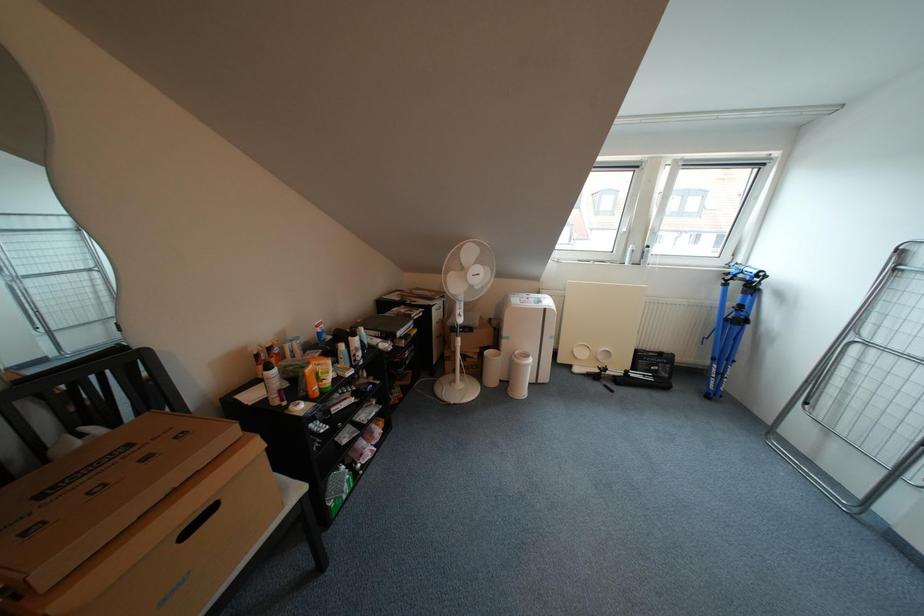
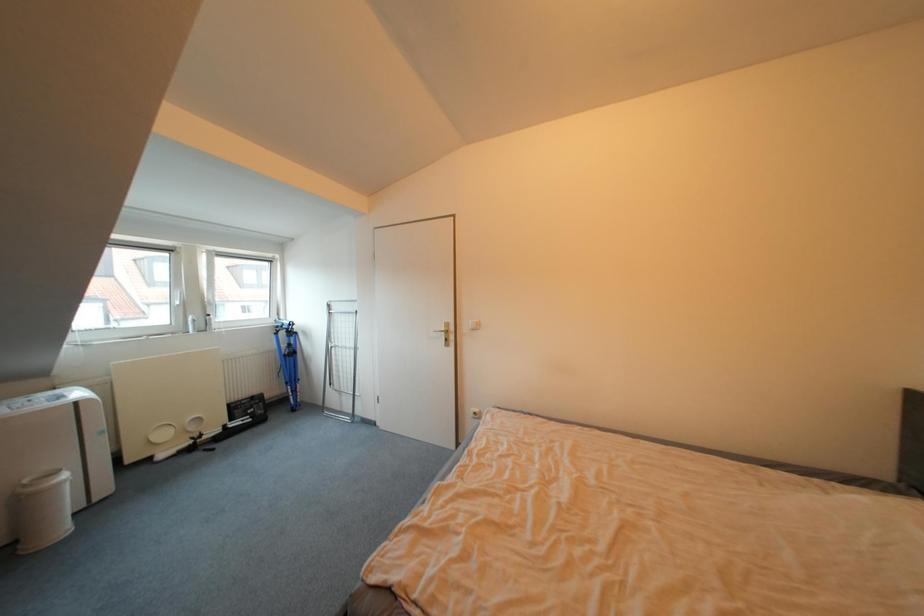
Question: Based on the continuous images, in which direction is the camera rotating? Reply with the corresponding letter.

Choices:
 (A) Left
 (B) Right
 (C) Up
 (D) Down

Answer: (B)